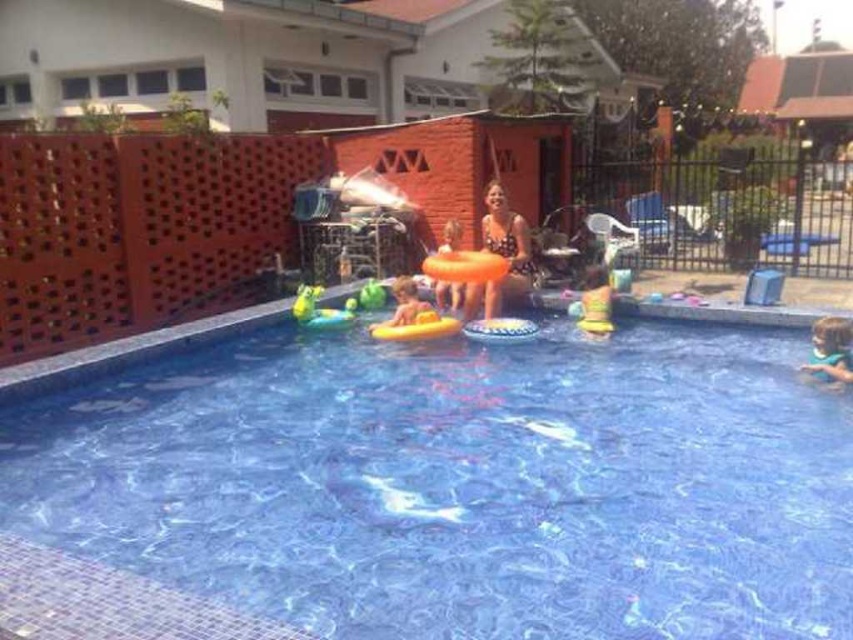
Looking at this image, you are a photographer taking a picture of the swimsuit fabric woman at center and the yellow rubber ring at center in the swimming pool. Which object should you focus on first if you want to capture both clearly in your shot?

The swimsuit fabric woman at center is above the yellow rubber ring at center, so you should focus on the swimsuit fabric woman at center first to ensure both are in clear focus.

You are a parent trying to ensure safety in the backyard. You have a 30 cm wide floating barrier that you want to place between the blue glossy water at center and the yellow rubber ring at center. Can the barrier fit between them?

The blue glossy water at center might be wider than yellow rubber ring at center, but since the exact distance isn not provided, it is uncertain if the 30 cm barrier will fit. Check the actual space between them before placing the barrier.

You are a photographer trying to capture both the swimsuit fabric woman at center and the green rubber duck at center in a single shot. Based on their sizes, which one should you focus on to ensure both fit in the frame?

The swimsuit fabric woman at center might be wider than the green rubber duck at center, so focusing on the woman would help ensure both fit in the frame since she is likely the larger object.